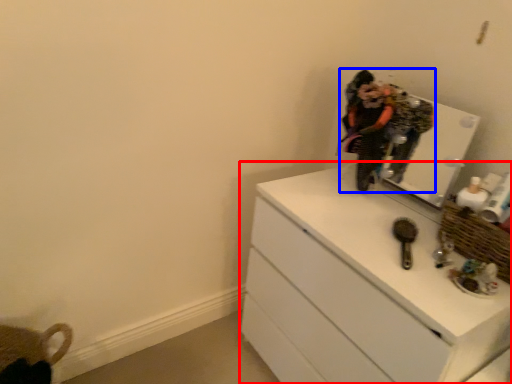
Question: Among these objects, which one is farthest to the camera, chest of drawers (highlighted by a red box) or person (highlighted by a blue box)?

Choices:
 (A) chest of drawers
 (B) person

Answer: (B)